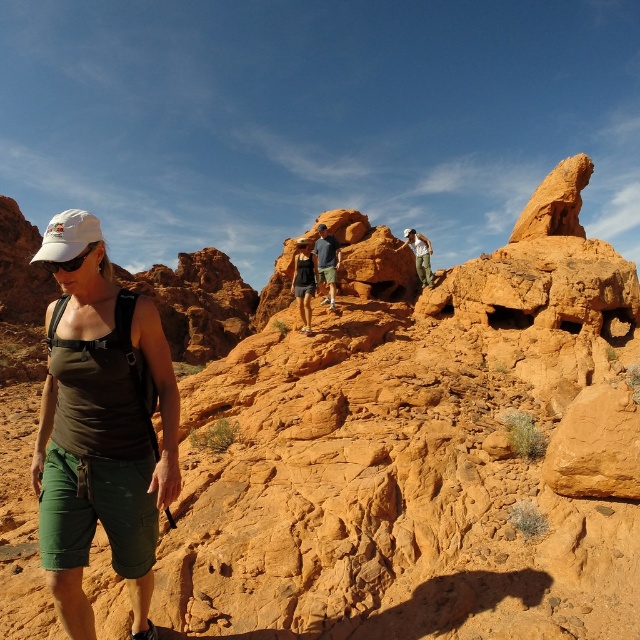
What are the coordinates of `matte blue shirt at center` in the screenshot? It's located at (326, 262).

Does matte blue shirt at center have a greater height compared to matte khaki pants at center?

Yes, matte blue shirt at center is taller than matte khaki pants at center.

This screenshot has height=640, width=640. In order to click on matte blue shirt at center in this screenshot , I will do `click(326, 262)`.

Which is more to the right, matte green shorts at center or matte black tank top at center?

From the viewer's perspective, matte black tank top at center appears more on the right side.

Is matte green shorts at center positioned before matte black tank top at center?

That is True.

Between point (38, 492) and point (300, 246), which one is positioned in front?

Point (38, 492)

Image resolution: width=640 pixels, height=640 pixels. I want to click on matte green shorts at center, so click(99, 429).

Is matte green shorts at center below matte khaki pants at center?

Yes, matte green shorts at center is below matte khaki pants at center.

Can you confirm if matte green shorts at center is shorter than matte khaki pants at center?

No.

Which is in front, point (92, 428) or point (412, 244)?

Point (92, 428) is in front.

Locate an element on the screen. The height and width of the screenshot is (640, 640). matte green shorts at center is located at coordinates (99, 429).